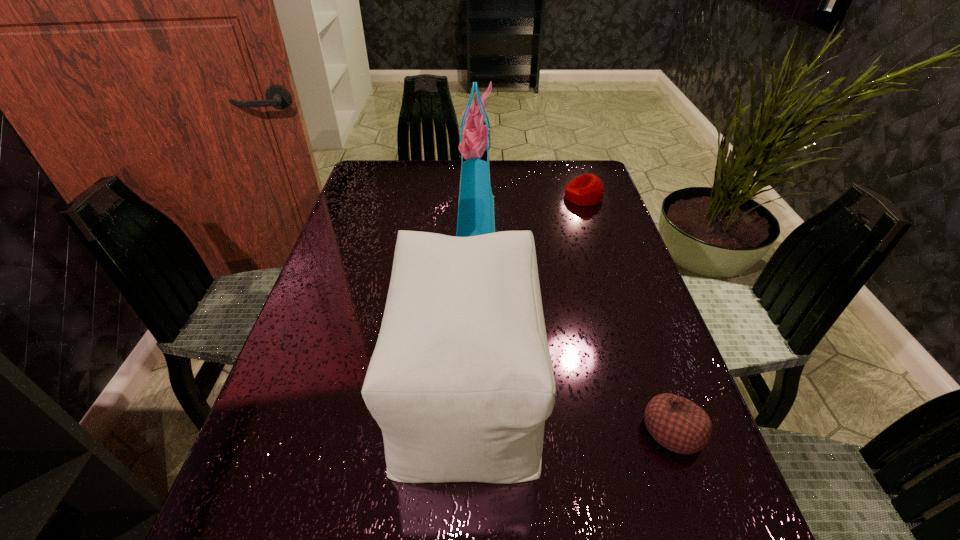
You are a GUI agent. You are given a task and a screenshot of the screen. Output one action in this format:
    pyautogui.click(x=<x>, y=<y>)
    Task: Click on the empty space between the tallest object and the nearer beanbag
    This screenshot has height=540, width=960.
    Given the screenshot: What is the action you would take?
    pyautogui.click(x=575, y=324)

In order to click on vacant space that's between the farther beanbag and the tallest object in this screenshot , I will do `click(530, 207)`.

At what (x,y) coordinates should I click in order to perform the action: click on free area in between the nearer beanbag and the farther beanbag. Please return your answer as a coordinate pair (x, y). Image resolution: width=960 pixels, height=540 pixels. Looking at the image, I should click on (628, 313).

You are a GUI agent. You are given a task and a screenshot of the screen. Output one action in this format:
    pyautogui.click(x=<x>, y=<y>)
    Task: Click on the vacant area that lies between the nearer beanbag and the farther beanbag
    The height and width of the screenshot is (540, 960).
    Given the screenshot: What is the action you would take?
    pyautogui.click(x=628, y=313)

Identify which object is the third closest to the nearer beanbag. Please provide its 2D coordinates. Your answer should be formatted as a tuple, i.e. [(x, y)], where the tuple contains the x and y coordinates of a point satisfying the conditions above.

[(586, 190)]

Find the location of a particular element. the closest object to the cushion is located at coordinates (676, 423).

The image size is (960, 540). I want to click on vacant space that satisfies the following two spatial constraints: 1. on the front side of the tallest object; 2. on the side of the third shortest object with the smiley face, so click(x=474, y=387).

At what (x,y) coordinates should I click in order to perform the action: click on vacant space that satisfies the following two spatial constraints: 1. on the back side of the nearer beanbag; 2. on the seat area of the farther beanbag. Please return your answer as a coordinate pair (x, y). The height and width of the screenshot is (540, 960). Looking at the image, I should click on (591, 197).

Locate an element on the screen. This screenshot has height=540, width=960. vacant space that satisfies the following two spatial constraints: 1. on the seat area of the farther beanbag; 2. on the left side of the nearer beanbag is located at coordinates (660, 430).

The width and height of the screenshot is (960, 540). Identify the location of free space that satisfies the following two spatial constraints: 1. on the back side of the nearer beanbag; 2. on the seat area of the farther beanbag. (591, 197).